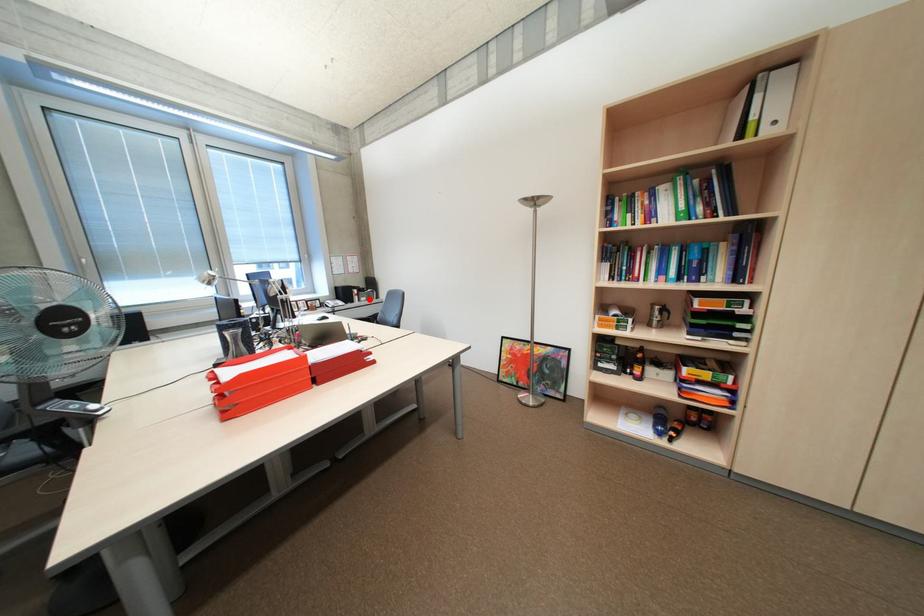
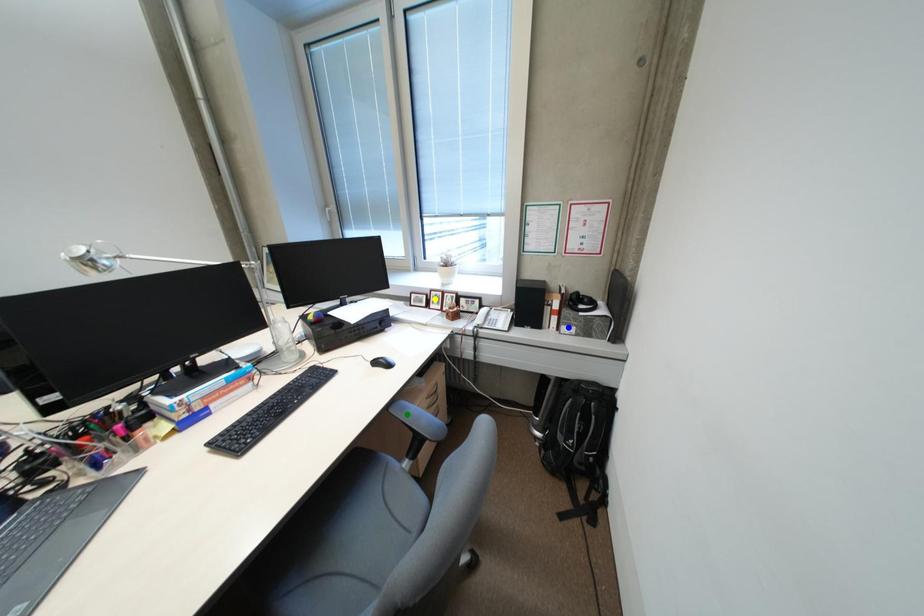
Question: I am providing you with two images of the same scene from different viewpoints. A red point is marked on the first image. You are given multiple points on the second image. Which point in image 2 represents the same 3d spot as the red point in image 1?

Choices:
 (A) green point
 (B) blue point
 (C) yellow point

Answer: (B)